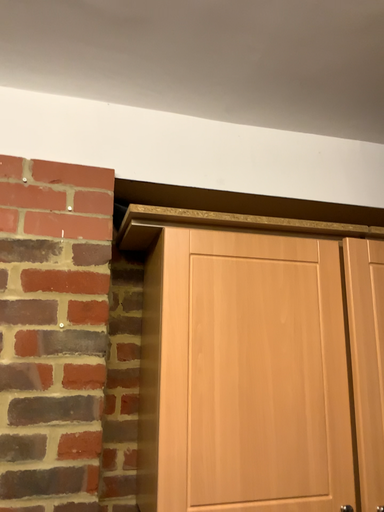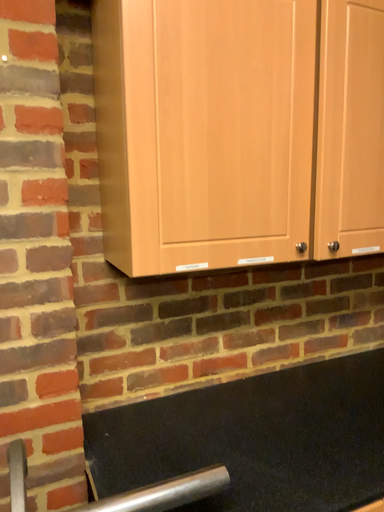
Question: Which way did the camera rotate in the video?

Choices:
 (A) rotated upward
 (B) rotated downward

Answer: (B)